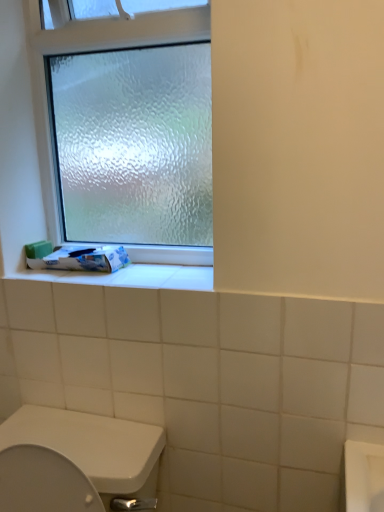
Question: Choose the correct answer: Is white glossy toilet paper at lower left inside frosted glass window at upper left or outside it?

Choices:
 (A) inside
 (B) outside

Answer: (B)

Question: Considering their positions, is white glossy toilet paper at lower left located in front of or behind frosted glass window at upper left?

Choices:
 (A) behind
 (B) front

Answer: (A)

Question: Considering the positions of point (107, 245) and point (153, 28), is point (107, 245) closer or farther from the camera than point (153, 28)?

Choices:
 (A) closer
 (B) farther

Answer: (B)

Question: Considering their positions, is frosted glass window at upper left located in front of or behind white glossy toilet paper at lower left?

Choices:
 (A) front
 (B) behind

Answer: (A)

Question: Looking at the image, does frosted glass window at upper left seem bigger or smaller compared to white glossy toilet paper at lower left?

Choices:
 (A) big
 (B) small

Answer: (A)

Question: In terms of width, does frosted glass window at upper left look wider or thinner when compared to white glossy toilet paper at lower left?

Choices:
 (A) wide
 (B) thin

Answer: (B)

Question: Considering the positions of point (39, 34) and point (114, 259), is point (39, 34) closer or farther from the camera than point (114, 259)?

Choices:
 (A) closer
 (B) farther

Answer: (A)